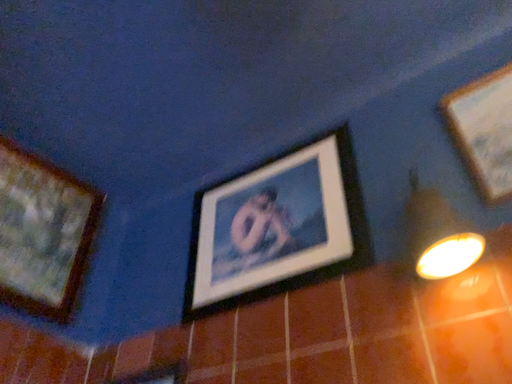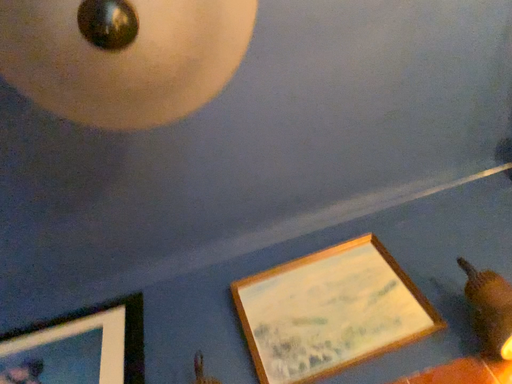
Question: Which way did the camera rotate in the video?

Choices:
 (A) rotated right
 (B) rotated left

Answer: (A)